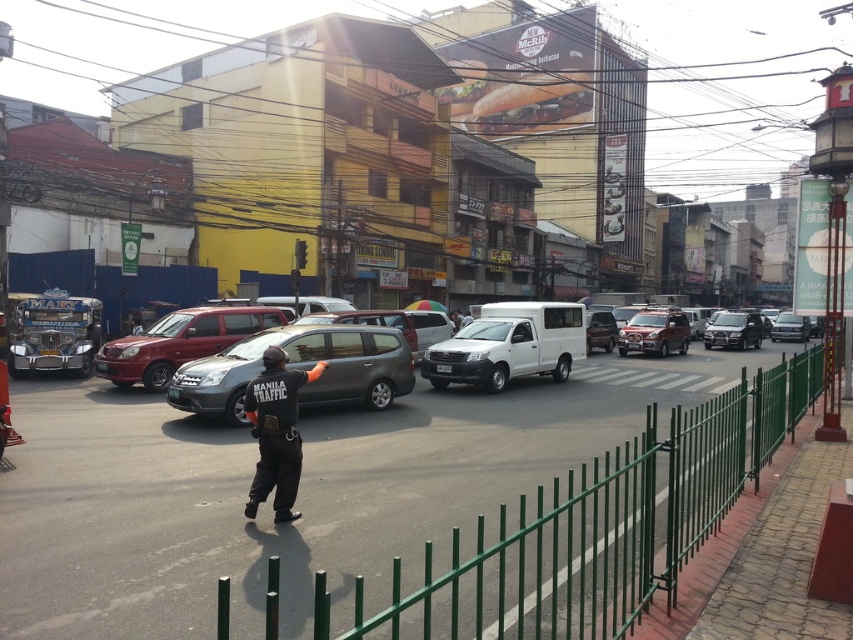
Question: Among these points, which one is nearest to the camera?

Choices:
 (A) pyautogui.click(x=374, y=353)
 (B) pyautogui.click(x=555, y=378)
 (C) pyautogui.click(x=741, y=346)

Answer: (A)

Question: Considering the real-world distances, which object is closest to the shiny silver sedan at center?

Choices:
 (A) white matte van at center
 (B) shiny black sedan at center-right
 (C) matte white van at center

Answer: (C)

Question: Which of the following is the closest to the observer?

Choices:
 (A) matte red suv at center
 (B) black uniform at center
 (C) metallic red suv at center-right

Answer: (B)

Question: Is satin silver van at center to the right of matte red suv at center from the viewer's perspective?

Choices:
 (A) yes
 (B) no

Answer: (A)

Question: Can you confirm if black uniform at center is wider than matte white van at center?

Choices:
 (A) yes
 (B) no

Answer: (B)

Question: Can you confirm if white matte van at center is positioned above metallic red suv at center-right?

Choices:
 (A) yes
 (B) no

Answer: (B)